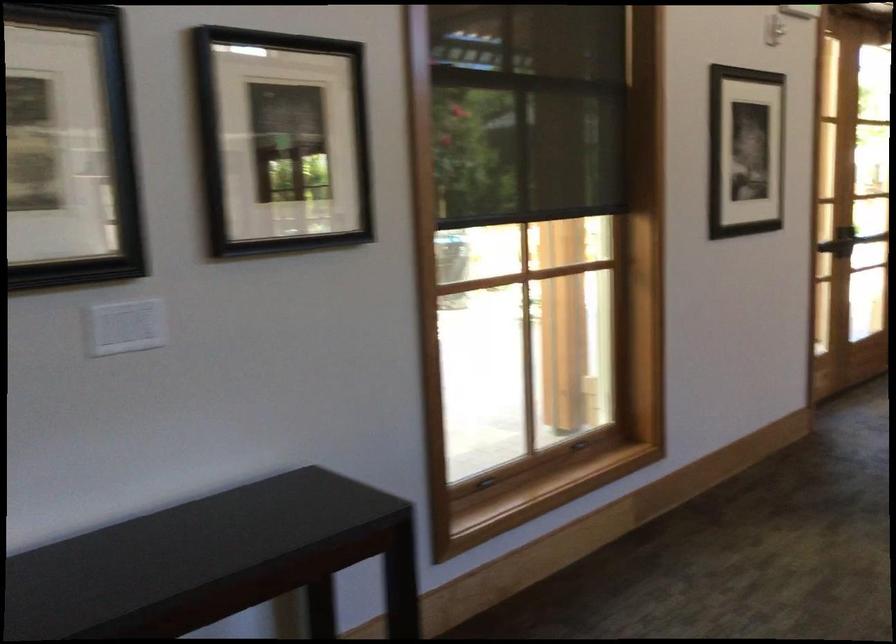
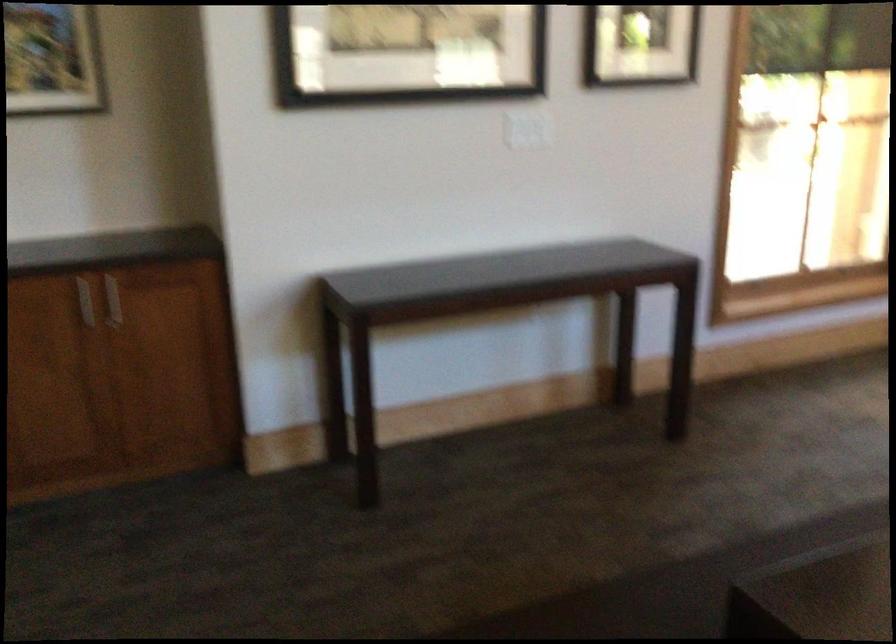
Question: What movement of the cameraman would produce the second image?

Choices:
 (A) Left
 (B) Right
 (C) Forward
 (D) Backward

Answer: (D)